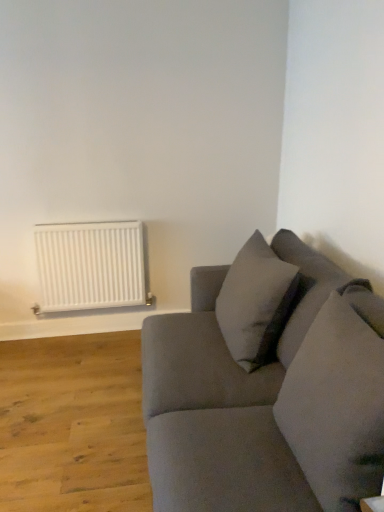
Identify the location of white matte radiator at left. This screenshot has width=384, height=512. (90, 266).

The image size is (384, 512). Describe the element at coordinates (256, 303) in the screenshot. I see `soft gray pillow at upper right, arranged as the 2th pillow when viewed from the front` at that location.

Identify the location of white matte radiator at left. This screenshot has width=384, height=512. (90, 266).

Is white matte radiator at left far away from suede gray couch at right?

That's right, there is a large distance between white matte radiator at left and suede gray couch at right.

Between white matte radiator at left and suede gray couch at right, which one has larger size?

Bigger between the two is suede gray couch at right.

From the image's perspective, relative to suede gray couch at right, is white matte radiator at left above or below?

Based on their image positions, white matte radiator at left is located above suede gray couch at right.

Is point (81, 285) less distant than point (342, 328)?

That is False.

From a real-world perspective, does suede-like gray pillow at right, which is the 1th pillow in front-to-back order, sit lower than white matte radiator at left?

Actually, suede-like gray pillow at right, which is the 1th pillow in front-to-back order, is physically above white matte radiator at left in the real world.

Which of these two, suede-like gray pillow at right, which is the 1th pillow in front-to-back order, or white matte radiator at left, stands shorter?

Standing shorter between the two is white matte radiator at left.

Between suede-like gray pillow at right, which is the 2th pillow from back to front, and white matte radiator at left, which one has smaller width?

white matte radiator at left.

Which point is more forward, (x=312, y=418) or (x=141, y=252)?

The point (x=312, y=418) is more forward.

From a real-world perspective, does soft gray pillow at upper right, the first pillow from the back, stand above suede-like gray pillow at right, which is the 2th pillow from back to front?

Yes, from a real-world perspective, soft gray pillow at upper right, the first pillow from the back, is above suede-like gray pillow at right, which is the 2th pillow from back to front.

Can suede-like gray pillow at right, which is the 2th pillow from back to front, be found inside soft gray pillow at upper right, arranged as the 2th pillow when viewed from the front?

No, suede-like gray pillow at right, which is the 2th pillow from back to front, is located outside of soft gray pillow at upper right, arranged as the 2th pillow when viewed from the front.

Is the depth of soft gray pillow at upper right, arranged as the 2th pillow when viewed from the front, less than that of suede-like gray pillow at right, which is the 1th pillow in front-to-back order?

No, soft gray pillow at upper right, arranged as the 2th pillow when viewed from the front, is behind suede-like gray pillow at right, which is the 1th pillow in front-to-back order.

Is soft gray pillow at upper right, arranged as the 2th pillow when viewed from the front, in contact with suede-like gray pillow at right, which is the 1th pillow in front-to-back order?

soft gray pillow at upper right, arranged as the 2th pillow when viewed from the front, and suede-like gray pillow at right, which is the 1th pillow in front-to-back order, are clearly separated.

Choose the correct answer: Is soft gray pillow at upper right, arranged as the 2th pillow when viewed from the front, inside suede gray couch at right or outside it?

soft gray pillow at upper right, arranged as the 2th pillow when viewed from the front, can be found inside suede gray couch at right.

Is soft gray pillow at upper right, the first pillow from the back, next to suede gray couch at right and touching it?

No, soft gray pillow at upper right, the first pillow from the back, is not touching suede gray couch at right.

Is soft gray pillow at upper right, arranged as the 2th pillow when viewed from the front, bigger or smaller than suede gray couch at right?

In the image, soft gray pillow at upper right, arranged as the 2th pillow when viewed from the front, appears to be smaller than suede gray couch at right.

The height and width of the screenshot is (512, 384). Identify the location of studio couch below the soft gray pillow at upper right, the first pillow from the back (from a real-world perspective). (267, 387).

From the image's perspective, which is below, suede-like gray pillow at right, which is the 1th pillow in front-to-back order, or soft gray pillow at upper right, arranged as the 2th pillow when viewed from the front?

suede-like gray pillow at right, which is the 1th pillow in front-to-back order, is shown below in the image.

In the image, is suede-like gray pillow at right, which is the 1th pillow in front-to-back order, positioned in front of or behind soft gray pillow at upper right, arranged as the 2th pillow when viewed from the front?

Clearly, suede-like gray pillow at right, which is the 1th pillow in front-to-back order, is in front of soft gray pillow at upper right, arranged as the 2th pillow when viewed from the front.

Can we say suede-like gray pillow at right, which is the 1th pillow in front-to-back order, lies outside soft gray pillow at upper right, arranged as the 2th pillow when viewed from the front?

Yes.

From a real-world perspective, is white matte radiator at left above or below soft gray pillow at upper right, arranged as the 2th pillow when viewed from the front?

In terms of real-world spatial position, white matte radiator at left is below soft gray pillow at upper right, arranged as the 2th pillow when viewed from the front.

From the image's perspective, is white matte radiator at left under soft gray pillow at upper right, the first pillow from the back?

Incorrect, from the image's perspective, white matte radiator at left is higher than soft gray pillow at upper right, the first pillow from the back.

How distant is white matte radiator at left from soft gray pillow at upper right, arranged as the 2th pillow when viewed from the front?

The distance of white matte radiator at left from soft gray pillow at upper right, arranged as the 2th pillow when viewed from the front, is 3.48 feet.

Considering the relative sizes of white matte radiator at left and soft gray pillow at upper right, arranged as the 2th pillow when viewed from the front, in the image provided, is white matte radiator at left shorter than soft gray pillow at upper right, arranged as the 2th pillow when viewed from the front,?

Yes.

Considering the sizes of objects white matte radiator at left and suede-like gray pillow at right, which is the 1th pillow in front-to-back order, in the image provided, who is taller, white matte radiator at left or suede-like gray pillow at right, which is the 1th pillow in front-to-back order,?

With more height is suede-like gray pillow at right, which is the 1th pillow in front-to-back order.

Would you say white matte radiator at left is outside suede-like gray pillow at right, which is the 2th pillow from back to front?

Yes.

From a real-world perspective, which is physically above, white matte radiator at left or suede-like gray pillow at right, which is the 2th pillow from back to front?

In real-world perspective, suede-like gray pillow at right, which is the 2th pillow from back to front, is above.

In order to click on radiator above the suede gray couch at right (from the image's perspective) in this screenshot , I will do `click(90, 266)`.

You are a GUI agent. You are given a task and a screenshot of the screen. Output one action in this format:
    pyautogui.click(x=<x>, y=<y>)
    Task: Click on the radiator that appears below the suede-like gray pillow at right, which is the 2th pillow from back to front (from a real-world perspective)
    
    Given the screenshot: What is the action you would take?
    pyautogui.click(x=90, y=266)

Which object lies nearer to the anchor point soft gray pillow at upper right, arranged as the 2th pillow when viewed from the front, suede gray couch at right or white matte radiator at left?

suede gray couch at right is closer to soft gray pillow at upper right, arranged as the 2th pillow when viewed from the front.

Looking at the image, which one is located closer to suede gray couch at right, soft gray pillow at upper right, the first pillow from the back, or white matte radiator at left?

soft gray pillow at upper right, the first pillow from the back, is closer to suede gray couch at right.

Based on their spatial positions, is white matte radiator at left or suede gray couch at right closer to soft gray pillow at upper right, arranged as the 2th pillow when viewed from the front?

Based on the image, suede gray couch at right appears to be nearer to soft gray pillow at upper right, arranged as the 2th pillow when viewed from the front.

When comparing their distances from suede gray couch at right, does suede-like gray pillow at right, which is the 1th pillow in front-to-back order, or white matte radiator at left seem closer?

suede-like gray pillow at right, which is the 1th pillow in front-to-back order, is closer to suede gray couch at right.

Based on their spatial positions, is suede gray couch at right or suede-like gray pillow at right, which is the 2th pillow from back to front, closer to white matte radiator at left?

suede gray couch at right lies closer to white matte radiator at left than the other object.

From the image, which object appears to be farther from suede gray couch at right, suede-like gray pillow at right, which is the 2th pillow from back to front, or soft gray pillow at upper right, the first pillow from the back?

Among the two, soft gray pillow at upper right, the first pillow from the back, is located further to suede gray couch at right.

Looking at the image, which one is located closer to suede gray couch at right, white matte radiator at left or suede-like gray pillow at right, which is the 1th pillow in front-to-back order?

Based on the image, suede-like gray pillow at right, which is the 1th pillow in front-to-back order, appears to be nearer to suede gray couch at right.

Estimate the real-world distances between objects in this image. Which object is further from suede gray couch at right, white matte radiator at left or soft gray pillow at upper right, the first pillow from the back?

white matte radiator at left lies further to suede gray couch at right than the other object.

You are a GUI agent. You are given a task and a screenshot of the screen. Output one action in this format:
    pyautogui.click(x=<x>, y=<y>)
    Task: Click on the pillow positioned between suede gray couch at right and soft gray pillow at upper right, the first pillow from the back, from near to far
    
    Given the screenshot: What is the action you would take?
    pyautogui.click(x=336, y=407)

Where is `pillow positioned between suede-like gray pillow at right, which is the 1th pillow in front-to-back order, and white matte radiator at left from near to far`? The height and width of the screenshot is (512, 384). pillow positioned between suede-like gray pillow at right, which is the 1th pillow in front-to-back order, and white matte radiator at left from near to far is located at coordinates (256, 303).